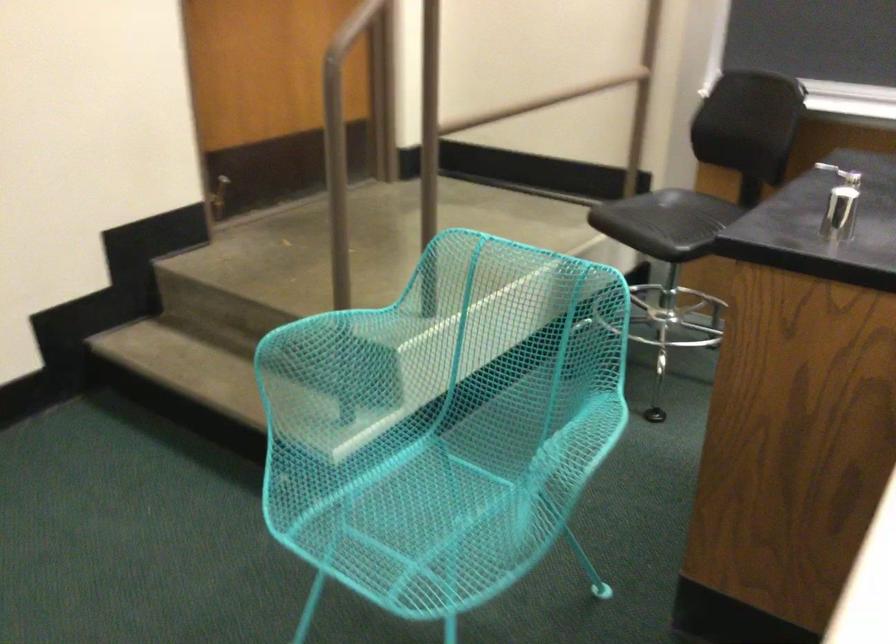
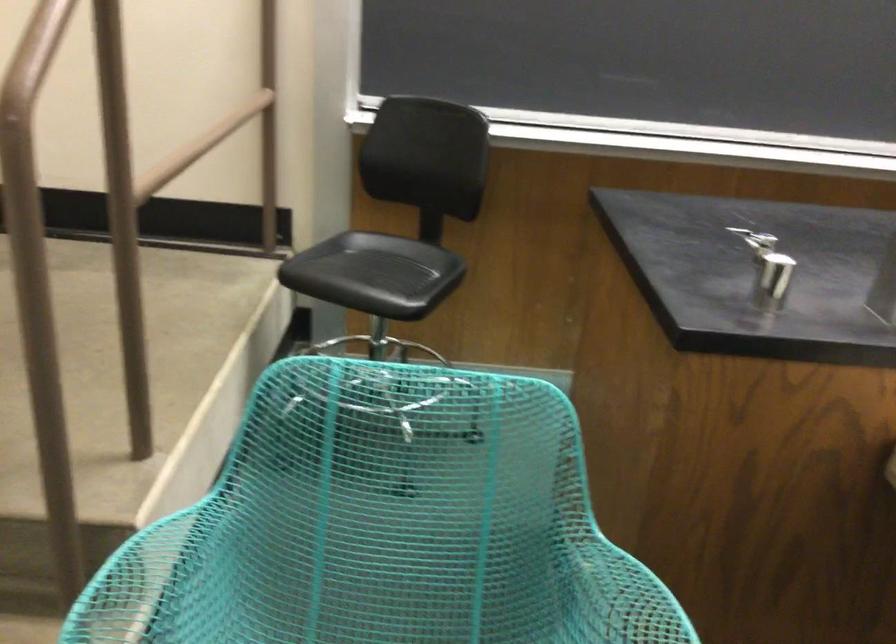
Question: How did the camera likely rotate?

Choices:
 (A) Left
 (B) Right
 (C) Up
 (D) Down

Answer: (B)